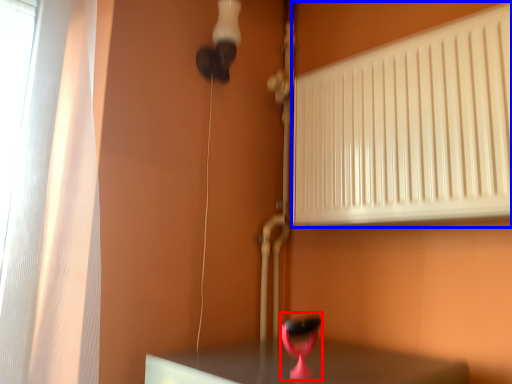
Question: Among these objects, which one is nearest to the camera, table lamp (highlighted by a red box) or radiator (highlighted by a blue box)?

Choices:
 (A) table lamp
 (B) radiator

Answer: (A)